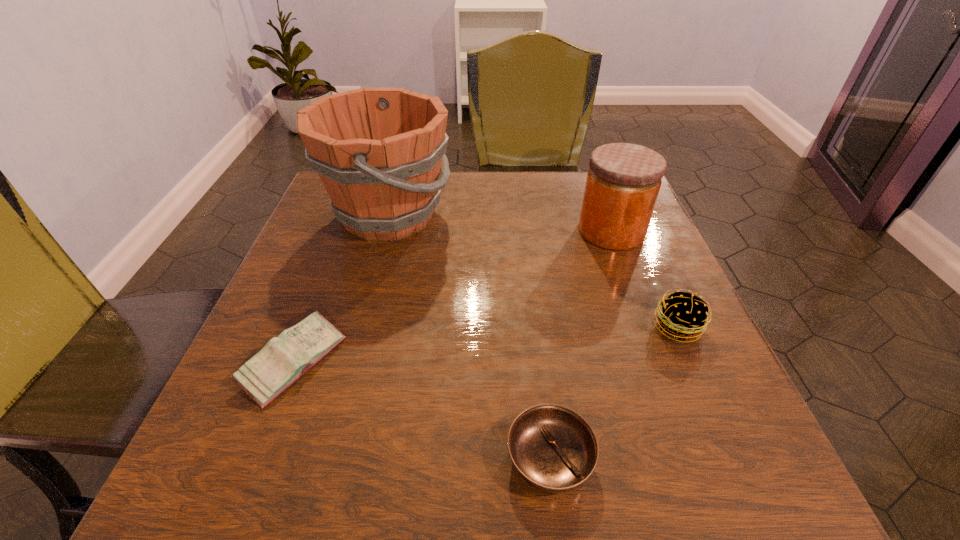
Where is `vacant area that lies between the diary and the second tallest object`? The height and width of the screenshot is (540, 960). vacant area that lies between the diary and the second tallest object is located at coordinates (452, 296).

Image resolution: width=960 pixels, height=540 pixels. Find the location of `unoccupied position between the second shortest object and the nearest object`. unoccupied position between the second shortest object and the nearest object is located at coordinates [421, 410].

The width and height of the screenshot is (960, 540). Identify the location of vacant area that lies between the third object from right to left and the patty. (613, 393).

Identify the location of vacant area that lies between the second tallest object and the patty. This screenshot has width=960, height=540. (644, 279).

Image resolution: width=960 pixels, height=540 pixels. I want to click on free point between the bucket and the jar, so click(500, 223).

Locate an element on the screen. The height and width of the screenshot is (540, 960). free spot between the tallest object and the third shortest object is located at coordinates (533, 271).

Image resolution: width=960 pixels, height=540 pixels. What are the coordinates of `the fourth closest object to the patty` in the screenshot? It's located at (284, 359).

Choose which object is the nearest neighbor to the shortest object. Please provide its 2D coordinates. Your answer should be formatted as a tuple, i.e. [(x, y)], where the tuple contains the x and y coordinates of a point satisfying the conditions above.

[(683, 315)]

The height and width of the screenshot is (540, 960). Identify the location of free space in the image that satisfies the following two spatial constraints: 1. on the front side of the diary; 2. on the right side of the nearest object. (256, 458).

Locate an element on the screen. The image size is (960, 540). vacant space that satisfies the following two spatial constraints: 1. on the front side of the jar; 2. on the right side of the third tallest object is located at coordinates (647, 327).